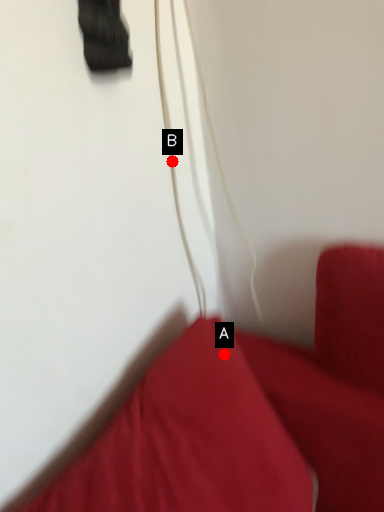
Question: Two points are circled on the image, labeled by A and B beside each circle. Which point appears farthest from the camera in this image?

Choices:
 (A) A is further
 (B) B is further

Answer: (B)